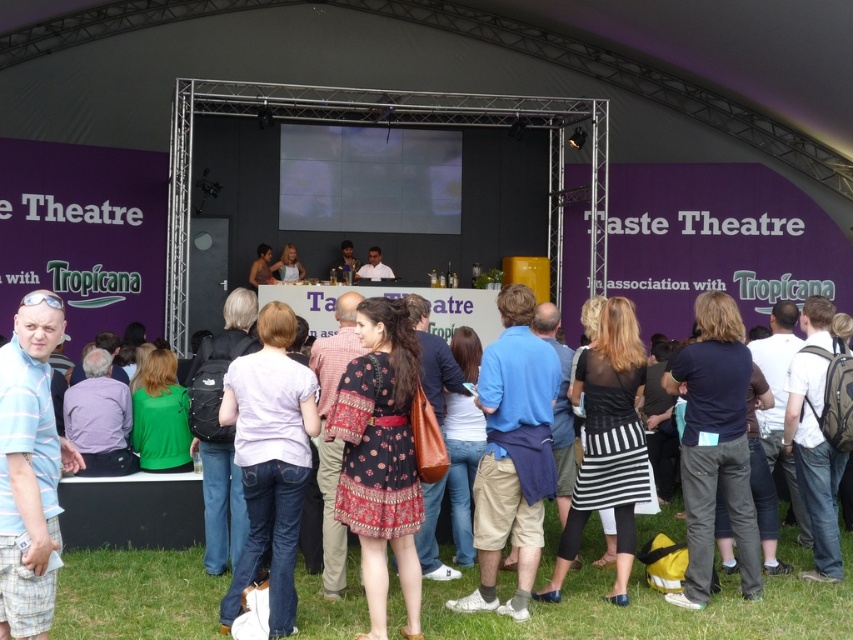
Does matte black shirt at center have a lesser width compared to white shirt at center?

Indeed, matte black shirt at center has a lesser width compared to white shirt at center.

Is matte black shirt at center closer to camera compared to white shirt at center?

That is True.

Describe the element at coordinates (260, 266) in the screenshot. The image size is (853, 640). I see `matte black shirt at center` at that location.

Where is `matte black shirt at center`? This screenshot has height=640, width=853. matte black shirt at center is located at coordinates (260, 266).

Between matte black shirt at center and metallic silver microphone at center, which one appears on the left side from the viewer's perspective?

Positioned to the left is matte black shirt at center.

Which is in front, point (265, 269) or point (339, 269)?

Point (265, 269) is more forward.

Where is `matte black shirt at center`? matte black shirt at center is located at coordinates (260, 266).

In order to click on matte black shirt at center in this screenshot , I will do `click(260, 266)`.

Looking at this image, does blue striped polo shirt at left appear over light brown hair at center?

No.

Who is positioned more to the left, blue striped polo shirt at left or light brown hair at center?

From the viewer's perspective, light brown hair at center appears more on the left side.

Is point (71, 468) positioned after point (292, 250)?

No, (71, 468) is in front of (292, 250).

At what (x,y) coordinates should I click in order to perform the action: click on blue striped polo shirt at left. Please return your answer as a coordinate pair (x, y). This screenshot has height=640, width=853. Looking at the image, I should click on (28, 467).